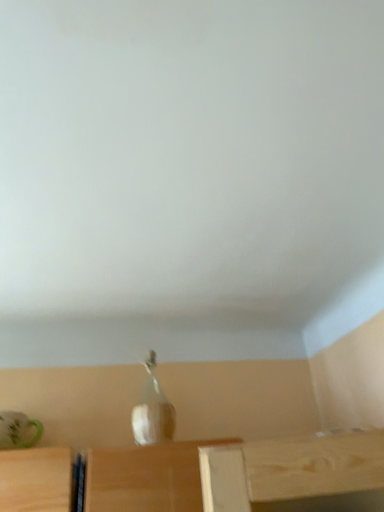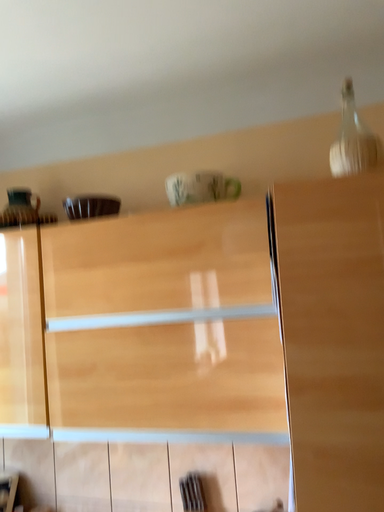
Question: Which way did the camera rotate in the video?

Choices:
 (A) rotated right
 (B) rotated left

Answer: (B)